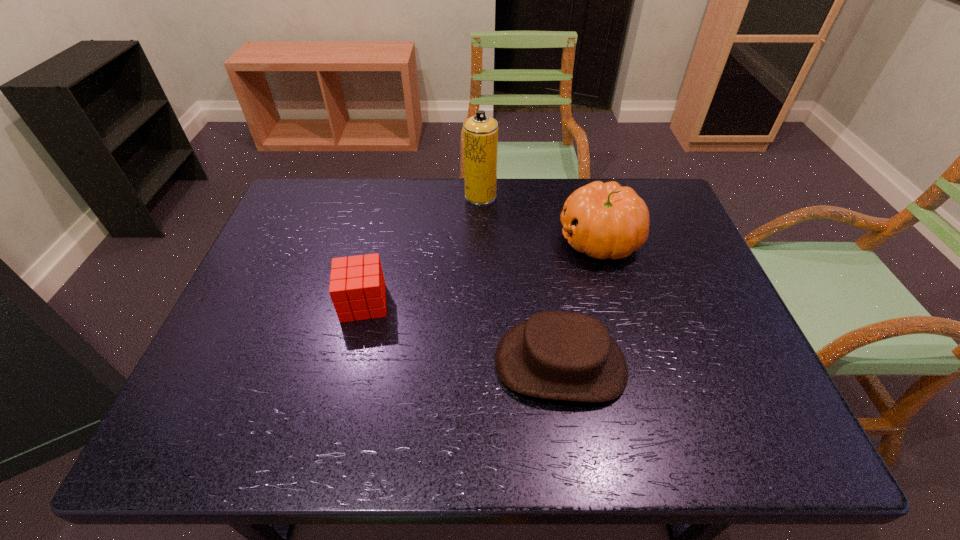
Image resolution: width=960 pixels, height=540 pixels. I want to click on free spot between the hat and the second nearest object, so click(462, 333).

Find the location of a particular element. vacant space in between the second farthest object and the cube is located at coordinates (482, 271).

You are a GUI agent. You are given a task and a screenshot of the screen. Output one action in this format:
    pyautogui.click(x=<x>, y=<y>)
    Task: Click on the blank region between the aerosol can and the nearest object
    Image resolution: width=960 pixels, height=540 pixels.
    Given the screenshot: What is the action you would take?
    pyautogui.click(x=520, y=280)

Identify the location of object that ranks as the third closest to the cube. (604, 220).

Select which object is the third closest to the hat. Please provide its 2D coordinates. Your answer should be formatted as a tuple, i.e. [(x, y)], where the tuple contains the x and y coordinates of a point satisfying the conditions above.

[(480, 132)]

The image size is (960, 540). Identify the location of vacant space that satisfies the following two spatial constraints: 1. on the carved face of the third nearest object; 2. on the front side of the hat. (636, 363).

At what (x,y) coordinates should I click in order to perform the action: click on vacant space that satisfies the following two spatial constraints: 1. on the front side of the leftmost object; 2. on the right side of the hat. Please return your answer as a coordinate pair (x, y). This screenshot has width=960, height=540. Looking at the image, I should click on (349, 363).

Find the location of a particular element. This screenshot has width=960, height=540. vacant area that satisfies the following two spatial constraints: 1. on the carved face of the second farthest object; 2. on the front side of the hat is located at coordinates (636, 363).

The image size is (960, 540). I want to click on vacant region that satisfies the following two spatial constraints: 1. on the front side of the leftmost object; 2. on the right side of the hat, so click(x=349, y=363).